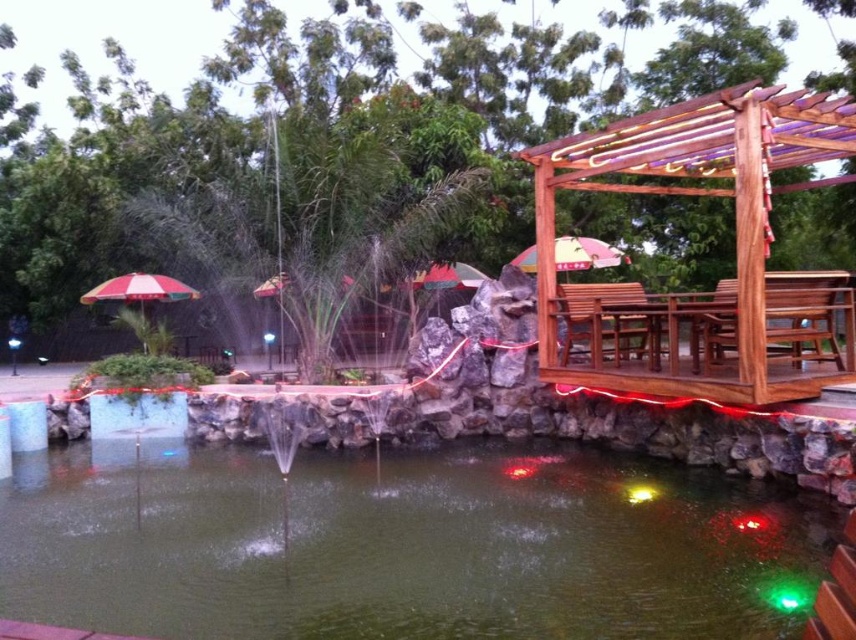
Question: Can you confirm if wooden pergola at right is positioned below multicolored fabric umbrella at center?

Choices:
 (A) no
 (B) yes

Answer: (B)

Question: Which of the following is the closest to the observer?

Choices:
 (A) (153, 288)
 (B) (586, 246)
 (C) (272, 499)

Answer: (C)

Question: Which object is closer to the camera taking this photo?

Choices:
 (A) wooden pergola at right
 (B) multicolored fabric umbrella at center
 (C) red and white striped umbrella at left

Answer: (A)

Question: Can you confirm if green liquid water at center is positioned to the left of multicolored fabric umbrella at center?

Choices:
 (A) no
 (B) yes

Answer: (B)

Question: Can you confirm if green liquid water at center is positioned to the left of wooden pergola at right?

Choices:
 (A) no
 (B) yes

Answer: (B)

Question: Which object appears closest to the camera in this image?

Choices:
 (A) multicolored fabric umbrella at center
 (B) green liquid water at center
 (C) wooden pergola at right
 (D) red and white striped umbrella at left

Answer: (B)